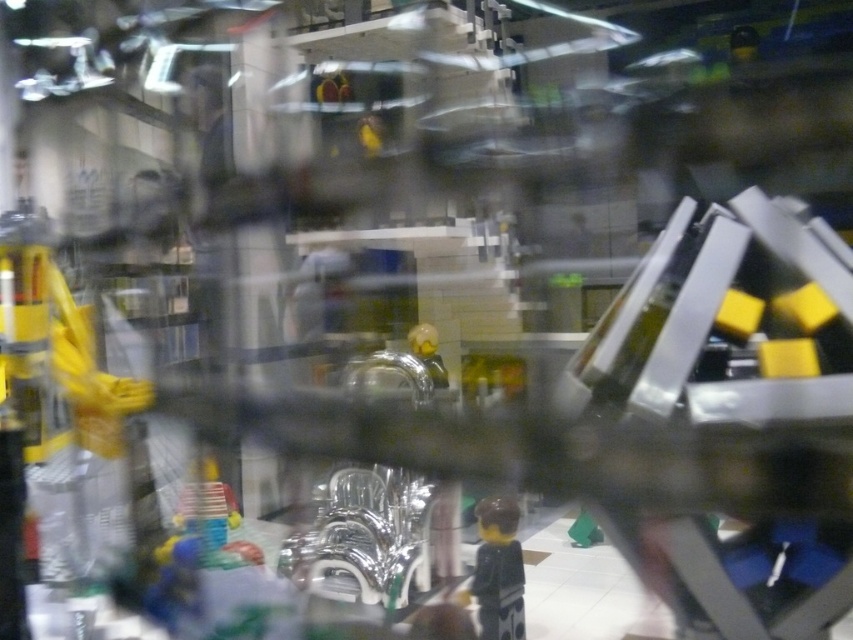
Question: Considering the relative positions of smooth black minifigure at center and yellow matte toy at center in the image provided, where is smooth black minifigure at center located with respect to yellow matte toy at center?

Choices:
 (A) left
 (B) right

Answer: (B)

Question: Does smooth black minifigure at center lie in front of yellow matte toy at center?

Choices:
 (A) no
 (B) yes

Answer: (B)

Question: Which point is closer to the camera taking this photo?

Choices:
 (A) (434, 328)
 (B) (486, 627)

Answer: (B)

Question: Can you confirm if smooth black minifigure at center is bigger than yellow matte toy at center?

Choices:
 (A) no
 (B) yes

Answer: (A)

Question: Which point appears closest to the camera in this image?

Choices:
 (A) (436, 387)
 (B) (482, 525)

Answer: (B)